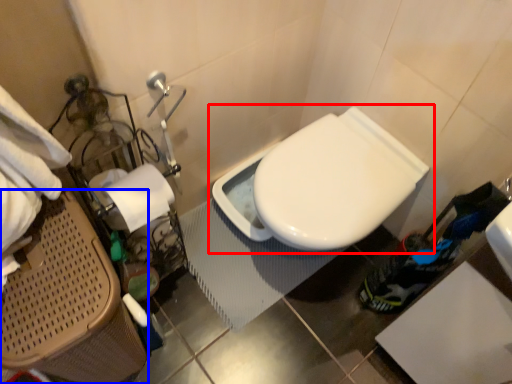
Question: Which of the following is the closest to the observer, toilet (highlighted by a red box) or laundry basket (highlighted by a blue box)?

Choices:
 (A) toilet
 (B) laundry basket

Answer: (B)